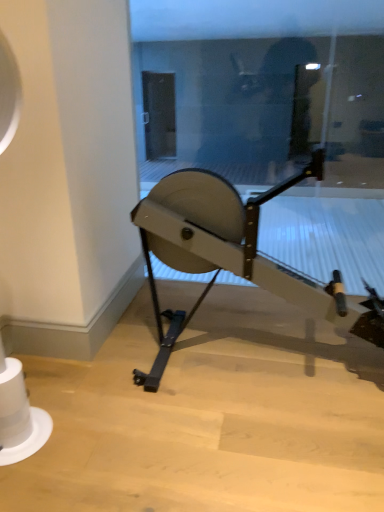
At what (x,y) coordinates should I click in order to perform the action: click on free spot in front of metallic silver exercise bike at center. Please return your answer as a coordinate pair (x, y). This screenshot has height=512, width=384. Looking at the image, I should click on pyautogui.click(x=253, y=451).